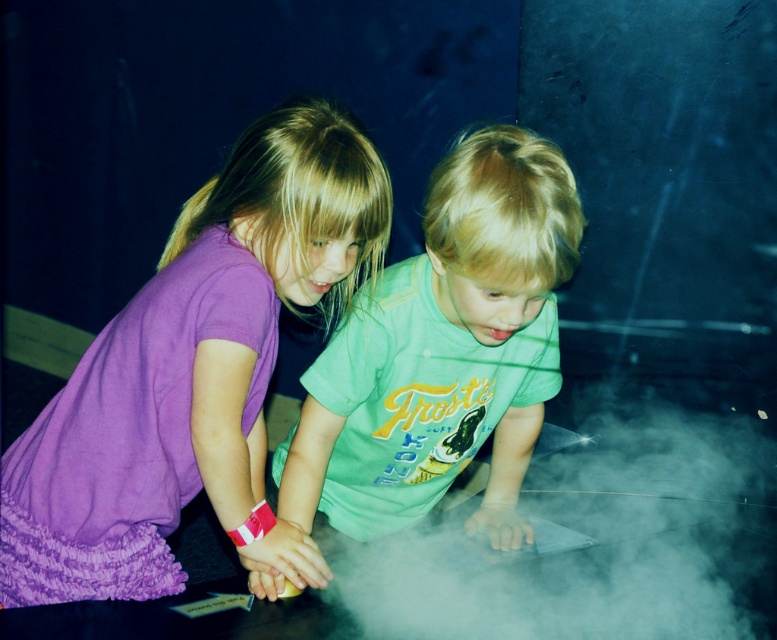
Can you confirm if purple fabric dress at left is positioned above white fog at center?

Yes, purple fabric dress at left is above white fog at center.

Is purple fabric dress at left to the left of white fog at center from the viewer's perspective?

Indeed, purple fabric dress at left is positioned on the left side of white fog at center.

Is point (335, 196) farther from camera compared to point (340, 570)?

No, it is in front of (340, 570).

At what (x,y) coordinates should I click in order to perform the action: click on purple fabric dress at left. Please return your answer as a coordinate pair (x, y). This screenshot has width=777, height=640. Looking at the image, I should click on (193, 372).

Can you confirm if purple fabric dress at left is positioned to the right of green matte shirt at center?

In fact, purple fabric dress at left is to the left of green matte shirt at center.

Can you confirm if purple fabric dress at left is shorter than green matte shirt at center?

In fact, purple fabric dress at left may be taller than green matte shirt at center.

Which is in front, point (335, 301) or point (323, 465)?

Point (323, 465) is in front.

Where is `purple fabric dress at left`? This screenshot has height=640, width=777. purple fabric dress at left is located at coordinates (193, 372).

Can you confirm if green matte shirt at center is positioned to the left of white fog at center?

Yes, green matte shirt at center is to the left of white fog at center.

Is green matte shirt at center wider than white fog at center?

Incorrect, green matte shirt at center's width does not surpass white fog at center's.

Does point (552, 144) come in front of point (667, 541)?

No, it is behind (667, 541).

I want to click on green matte shirt at center, so click(443, 352).